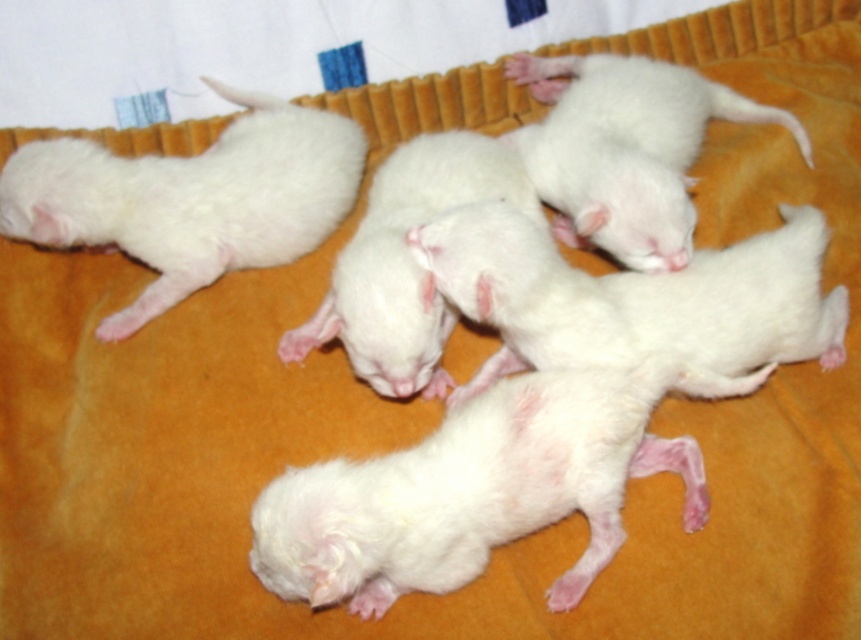
Question: Which object is farther from the camera taking this photo?

Choices:
 (A) white fluffy kitten at upper left
 (B) white fluffy kitten at upper center

Answer: (A)

Question: Among these points, which one is farthest from the camera?

Choices:
 (A) (125, 188)
 (B) (505, 499)

Answer: (A)

Question: Can you confirm if white fluffy puppies at center is positioned above white fluffy kitten at upper left?

Choices:
 (A) no
 (B) yes

Answer: (A)

Question: Is white fluffy puppy at center smaller than white fluffy puppies at center?

Choices:
 (A) no
 (B) yes

Answer: (A)

Question: Which point is farther to the camera?

Choices:
 (A) white fluffy kitten at upper left
 (B) white fluffy kitten at upper center

Answer: (A)

Question: Is the position of white fluffy puppy at center more distant than that of white fluffy kitten at upper center?

Choices:
 (A) yes
 (B) no

Answer: (B)